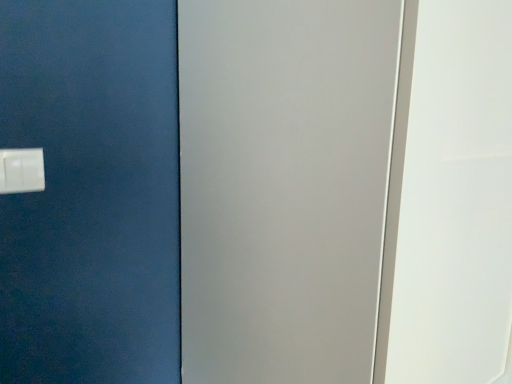
Locate an element on the screen. The height and width of the screenshot is (384, 512). satin white screen door at center is located at coordinates (284, 186).

Describe the element at coordinates (284, 186) in the screenshot. This screenshot has height=384, width=512. I see `satin white screen door at center` at that location.

Looking at this image, measure the distance between point (x=22, y=175) and camera.

A distance of 32.60 inches exists between point (x=22, y=175) and camera.

Describe the element at coordinates (21, 170) in the screenshot. The image size is (512, 384). I see `white plastic light switch at lower left` at that location.

You are a GUI agent. You are given a task and a screenshot of the screen. Output one action in this format:
    pyautogui.click(x=<x>, y=<y>)
    Task: Click on the white plastic light switch at lower left
    Image resolution: width=512 pixels, height=384 pixels.
    Given the screenshot: What is the action you would take?
    pyautogui.click(x=21, y=170)

Locate an element on the screen. The height and width of the screenshot is (384, 512). satin white screen door at center is located at coordinates (284, 186).

Between satin white screen door at center and white plastic light switch at lower left, which one appears on the left side from the viewer's perspective?

From the viewer's perspective, white plastic light switch at lower left appears more on the left side.

Is the depth of satin white screen door at center greater than that of white plastic light switch at lower left?

No, satin white screen door at center is in front of white plastic light switch at lower left.

Does point (355, 371) come behind point (16, 180)?

No, (355, 371) is in front of (16, 180).

From the image's perspective, is satin white screen door at center positioned above or below white plastic light switch at lower left?

satin white screen door at center is below white plastic light switch at lower left.

From a real-world perspective, is satin white screen door at center physically above white plastic light switch at lower left?

No.

Between satin white screen door at center and white plastic light switch at lower left, which one has smaller width?

white plastic light switch at lower left is thinner.

Can you confirm if satin white screen door at center is shorter than white plastic light switch at lower left?

No.

From the picture: Considering the sizes of objects satin white screen door at center and white plastic light switch at lower left in the image provided, who is bigger, satin white screen door at center or white plastic light switch at lower left?

Bigger between the two is satin white screen door at center.

Choose the correct answer: Is satin white screen door at center inside white plastic light switch at lower left or outside it?

satin white screen door at center is not inside white plastic light switch at lower left, it's outside.

Is there a large distance between satin white screen door at center and white plastic light switch at lower left?

Actually, satin white screen door at center and white plastic light switch at lower left are a little close together.

Is white plastic light switch at lower left at the back of satin white screen door at center?

satin white screen door at center is not turned away from white plastic light switch at lower left.

How many degrees apart are the facing directions of satin white screen door at center and white plastic light switch at lower left?

There is a 4.09-degree angle between the facing directions of satin white screen door at center and white plastic light switch at lower left.

Locate an element on the screen. This screenshot has height=384, width=512. light switch on the left of satin white screen door at center is located at coordinates (21, 170).

Considering the positions of objects white plastic light switch at lower left and satin white screen door at center in the image provided, who is more to the left, white plastic light switch at lower left or satin white screen door at center?

From the viewer's perspective, white plastic light switch at lower left appears more on the left side.

Which object is closer to the camera taking this photo, white plastic light switch at lower left or satin white screen door at center?

satin white screen door at center is more forward.

Which is closer to the camera, [12,154] or [370,100]?

Point [12,154] appears to be farther away from the viewer than point [370,100].

From the image's perspective, does white plastic light switch at lower left appear higher than satin white screen door at center?

Indeed, from the image's perspective, white plastic light switch at lower left is shown above satin white screen door at center.

From a real-world perspective, is white plastic light switch at lower left physically located above or below satin white screen door at center?

In terms of real-world spatial position, white plastic light switch at lower left is above satin white screen door at center.

Is white plastic light switch at lower left wider than satin white screen door at center?

No.

Who is taller, white plastic light switch at lower left or satin white screen door at center?

Standing taller between the two is satin white screen door at center.

Between white plastic light switch at lower left and satin white screen door at center, which one has larger size?

Bigger between the two is satin white screen door at center.

Is satin white screen door at center located within white plastic light switch at lower left?

Actually, satin white screen door at center is outside white plastic light switch at lower left.

Is white plastic light switch at lower left in contact with satin white screen door at center?

They are not placed beside each other.

Does white plastic light switch at lower left turn towards satin white screen door at center?

No, white plastic light switch at lower left does not turn towards satin white screen door at center.

Can you tell me how much white plastic light switch at lower left and satin white screen door at center differ in facing direction?

white plastic light switch at lower left and satin white screen door at center are facing 4.09 degrees away from each other.

Measure the distance from white plastic light switch at lower left to satin white screen door at center.

white plastic light switch at lower left is 19.36 inches from satin white screen door at center.

Find the location of a particular element. Image resolution: width=512 pixels, height=384 pixels. screen door on the right of white plastic light switch at lower left is located at coordinates (284, 186).

Where is `screen door that appears below the white plastic light switch at lower left (from a real-world perspective)`? The width and height of the screenshot is (512, 384). screen door that appears below the white plastic light switch at lower left (from a real-world perspective) is located at coordinates (284, 186).

The image size is (512, 384). I want to click on light switch that is behind the satin white screen door at center, so click(x=21, y=170).